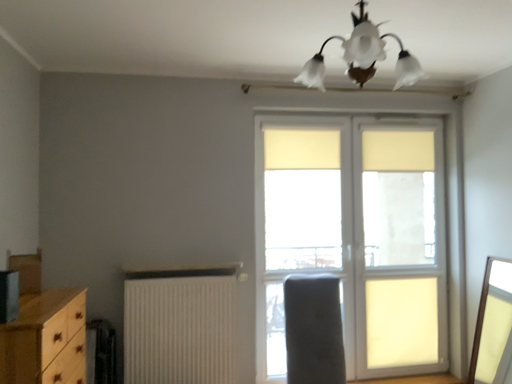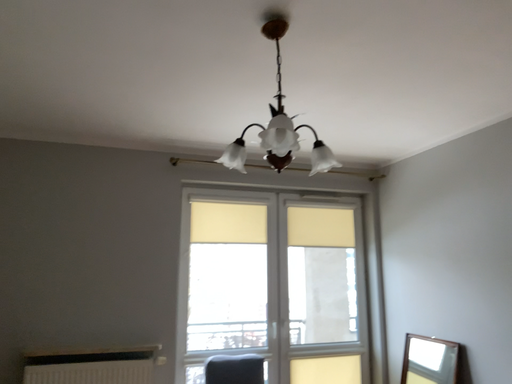
Question: Which way did the camera rotate in the video?

Choices:
 (A) rotated upward
 (B) rotated downward

Answer: (A)